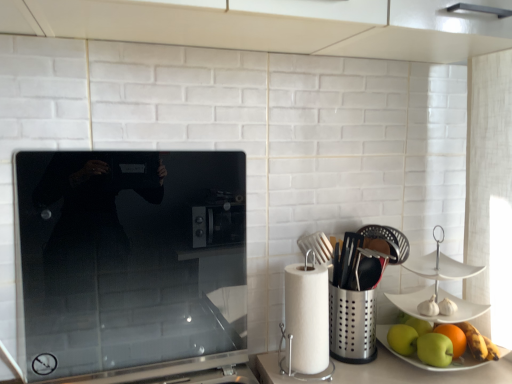
Question: From a real-world perspective, is smooth glass cooktop at center beneath white paper towel at right?

Choices:
 (A) no
 (B) yes

Answer: (A)

Question: Does smooth glass cooktop at center have a larger size compared to white paper towel at right?

Choices:
 (A) yes
 (B) no

Answer: (A)

Question: Is white paper towel at right surrounded by smooth glass cooktop at center?

Choices:
 (A) no
 (B) yes

Answer: (A)

Question: Does smooth glass cooktop at center have a greater width compared to white paper towel at right?

Choices:
 (A) yes
 (B) no

Answer: (B)

Question: Is there a large distance between smooth glass cooktop at center and white paper towel at right?

Choices:
 (A) no
 (B) yes

Answer: (A)

Question: In terms of size, does smooth glass cooktop at center appear bigger or smaller than green matte apple at lower right, the 1th apple from the left?

Choices:
 (A) small
 (B) big

Answer: (B)

Question: Is smooth glass cooktop at center wider or thinner than green matte apple at lower right, the 1th apple from the left?

Choices:
 (A) thin
 (B) wide

Answer: (A)

Question: Relative to green matte apple at lower right, the 1th apple from the left, is smooth glass cooktop at center in front or behind?

Choices:
 (A) behind
 (B) front

Answer: (B)

Question: From a real-world perspective, is smooth glass cooktop at center above or below green matte apple at lower right, which ranks as the third apple in right-to-left order?

Choices:
 (A) above
 (B) below

Answer: (A)

Question: In terms of width, does green matte apple at lower right, arranged as the second apple when viewed from the right, look wider or thinner when compared to smooth glass cooktop at center?

Choices:
 (A) wide
 (B) thin

Answer: (A)

Question: Do you think green matte apple at lower right, acting as the second apple starting from the left, is within smooth glass cooktop at center, or outside of it?

Choices:
 (A) inside
 (B) outside

Answer: (B)

Question: Would you say green matte apple at lower right, arranged as the second apple when viewed from the right, is to the left or to the right of smooth glass cooktop at center in the picture?

Choices:
 (A) left
 (B) right

Answer: (B)

Question: Based on their sizes in the image, would you say green matte apple at lower right, arranged as the second apple when viewed from the right, is bigger or smaller than smooth glass cooktop at center?

Choices:
 (A) big
 (B) small

Answer: (B)

Question: In terms of size, does green matte apple at lower right, which ranks as the third apple in right-to-left order, appear bigger or smaller than smooth glass cooktop at center?

Choices:
 (A) small
 (B) big

Answer: (A)

Question: From a real-world perspective, relative to smooth glass cooktop at center, is green matte apple at lower right, the 1th apple from the left, vertically above or below?

Choices:
 (A) below
 (B) above

Answer: (A)